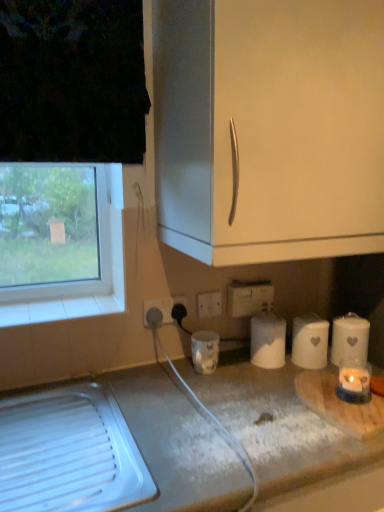
Find the location of `vacant space that's between white matte paper towel at lower right, the second paper towel in the left-to-right sequence, and white ceramic candle at lower center`. vacant space that's between white matte paper towel at lower right, the second paper towel in the left-to-right sequence, and white ceramic candle at lower center is located at coordinates (250, 371).